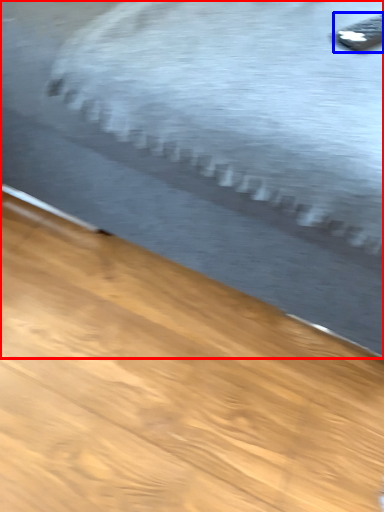
Question: Which object is closer to the camera taking this photo, bed (highlighted by a red box) or remote (highlighted by a blue box)?

Choices:
 (A) bed
 (B) remote

Answer: (A)